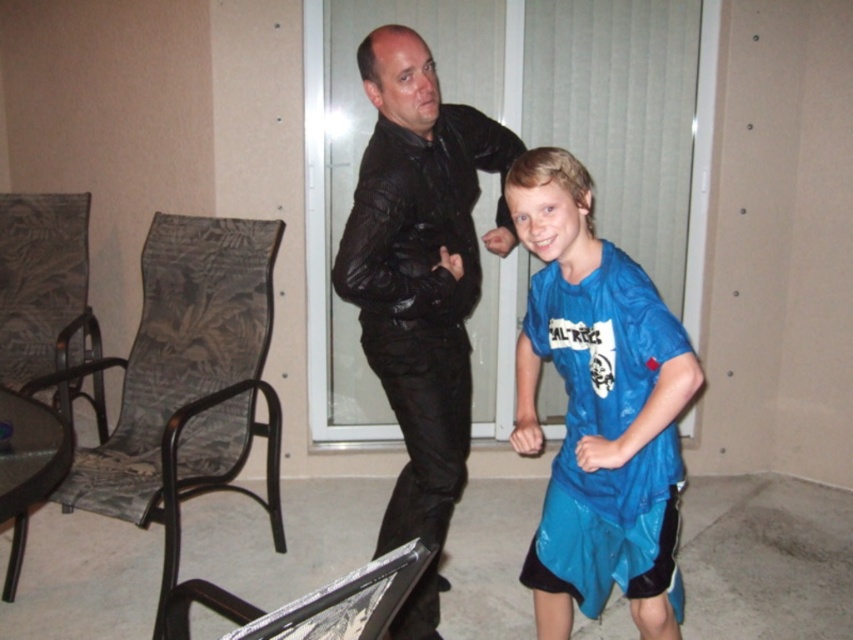
Question: Can you confirm if blue shiny t-shirt at center is positioned to the left of black leather jacket at center?

Choices:
 (A) yes
 (B) no

Answer: (B)

Question: Which of the following is the farthest from the observer?

Choices:
 (A) (675, 593)
 (B) (397, 273)

Answer: (B)

Question: Among these points, which one is nearest to the camera?

Choices:
 (A) (552, 243)
 (B) (383, 198)

Answer: (A)

Question: Is blue shiny t-shirt at center above black leather jacket at center?

Choices:
 (A) yes
 (B) no

Answer: (B)

Question: Does blue shiny t-shirt at center have a smaller size compared to black leather jacket at center?

Choices:
 (A) yes
 (B) no

Answer: (A)